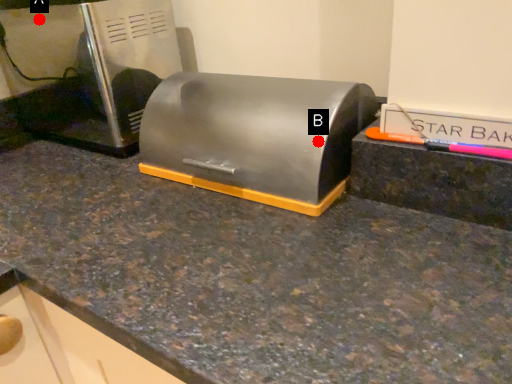
Question: Two points are circled on the image, labeled by A and B beside each circle. Which point is farther to the camera?

Choices:
 (A) A is further
 (B) B is further

Answer: (A)